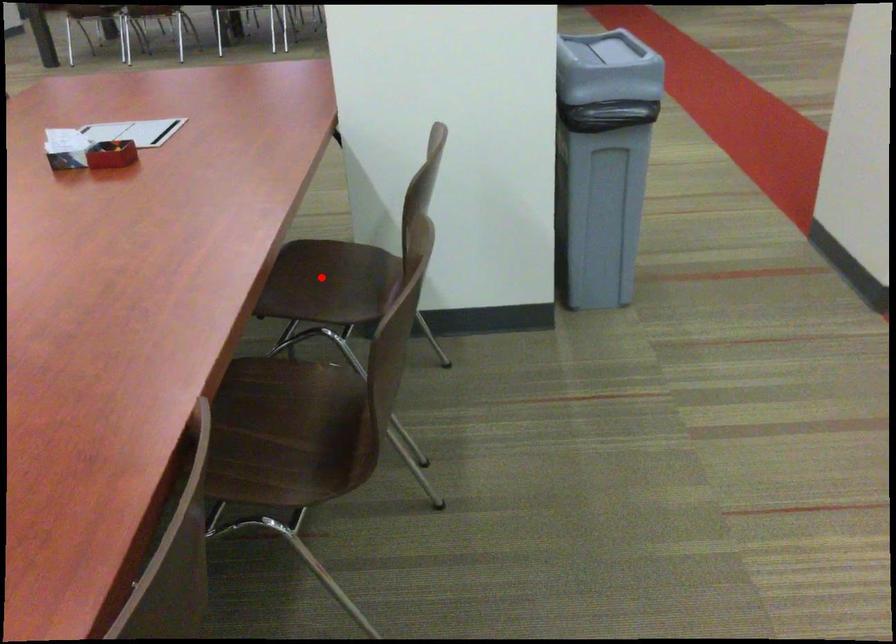
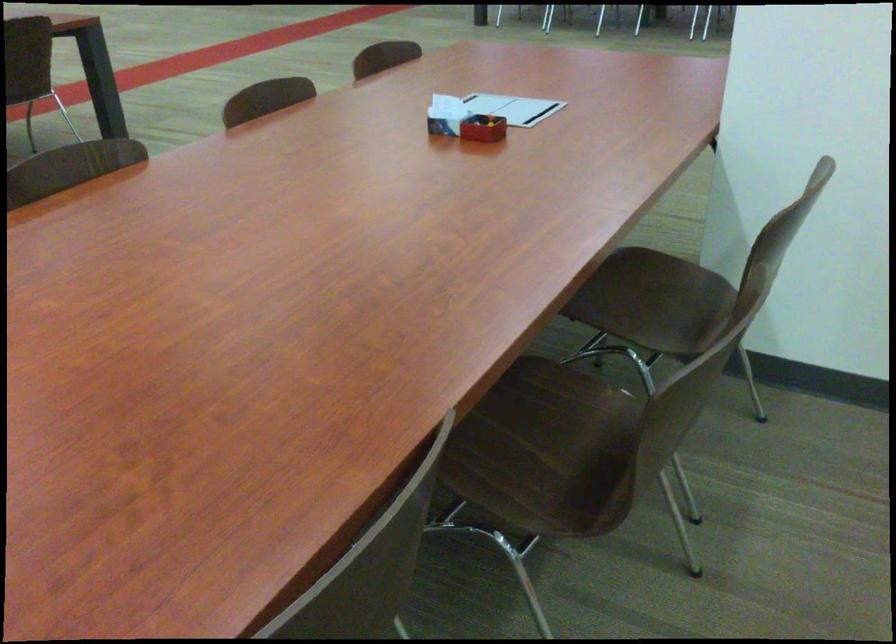
Where in the second image is the point corresponding to the highlighted location from the first image?

(644, 289)